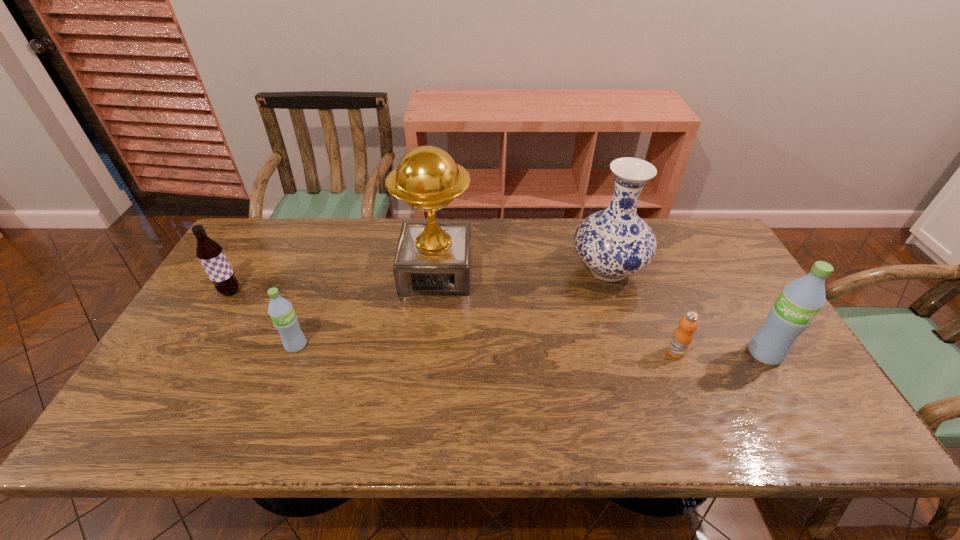
This screenshot has width=960, height=540. I want to click on the shorter water bottle, so (281, 311).

This screenshot has height=540, width=960. I want to click on the second object from left to right, so click(281, 311).

The height and width of the screenshot is (540, 960). I want to click on the taller water bottle, so click(x=800, y=301).

The height and width of the screenshot is (540, 960). I want to click on the rightmost object, so click(800, 301).

Find the location of a particular element. The image size is (960, 540). the fourth object from right to left is located at coordinates (433, 258).

The image size is (960, 540). Identify the location of root beer. (211, 255).

Locate an element on the screen. vase is located at coordinates (614, 243).

Where is `orange juice`? This screenshot has height=540, width=960. orange juice is located at coordinates (688, 324).

Where is `blank space located 0.110m on the front of the shorter water bottle`? blank space located 0.110m on the front of the shorter water bottle is located at coordinates (278, 392).

Image resolution: width=960 pixels, height=540 pixels. In order to click on vacant space located 0.100m on the back of the rightmost object in this screenshot , I will do `click(740, 313)`.